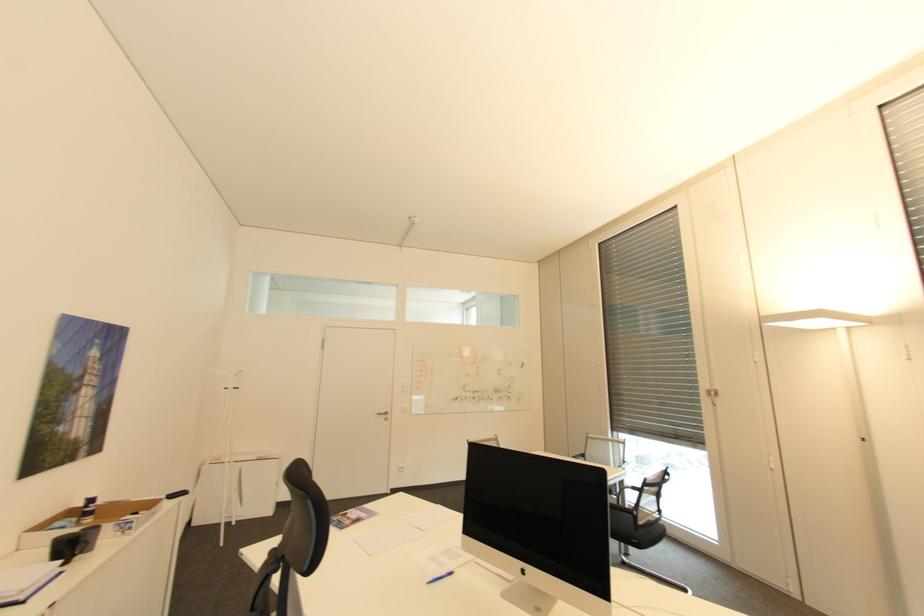
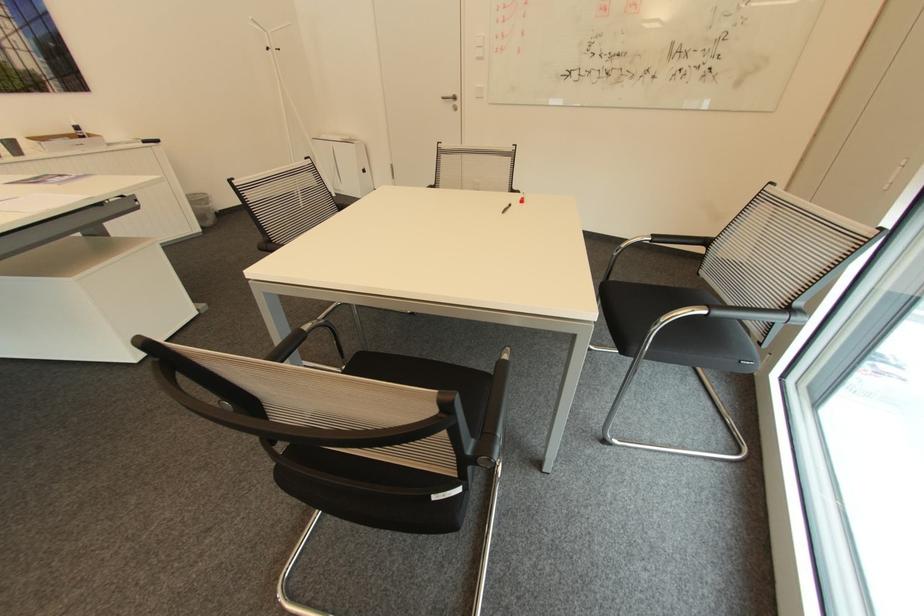
Find the pixel in the second image that matches pixel 387 411 in the first image.

(456, 95)